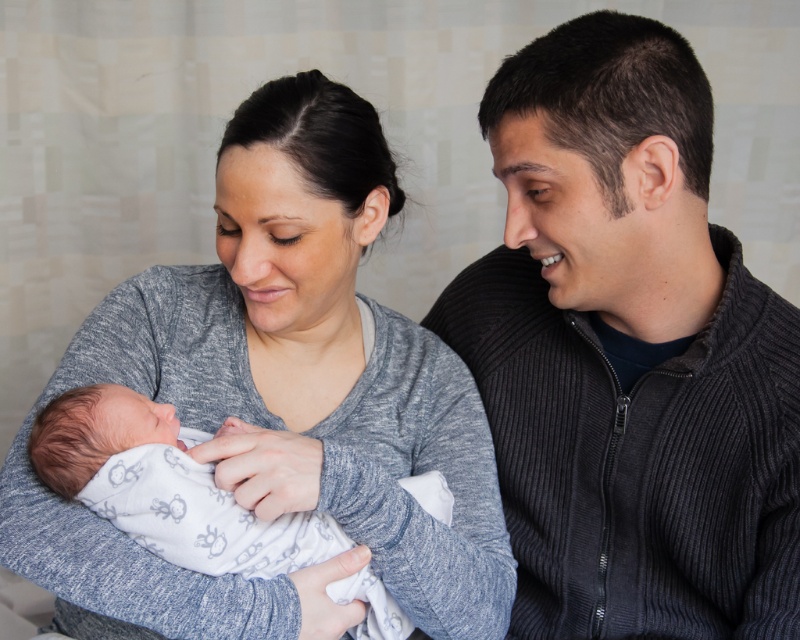
You are a photographer setting up a studio session for this family. You need to ensure that the dark gray corduroy sweater at right and the white soft fabric newborn at center are both visible in the frame. Given their sizes, which object might require more space in the composition?

The white soft fabric newborn at center requires more space in the composition because the dark gray corduroy sweater at right is thinner than it.

You are a photographer setting up for a family photo. You need to position the white soft fabric newborn at center so it is visible in front of the dark gray corduroy sweater at right. Is the current arrangement suitable?

The white soft fabric newborn at center is currently behind the dark gray corduroy sweater at right, so the newborn will not be fully visible. Adjust the positioning to bring the newborn forward so it is in front of the sweater.

You are a photographer setting up for a family portrait. You need to position a reflector to bounce light onto the gray soft fabric baby at center without illuminating the dark gray corduroy sweater at right. Based on their positions, where should you place the reflector relative to the subjects?

The dark gray corduroy sweater at right is closer to the viewer than the gray soft fabric baby at center. To direct light onto the baby without hitting the sweater, place the reflector behind the sweater, angled so the light reflects towards the baby while avoiding the closer sweater.